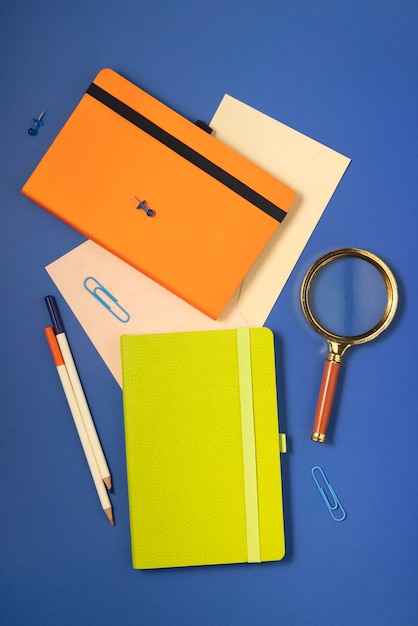
Where is `green notebook`? green notebook is located at coordinates (143, 452).